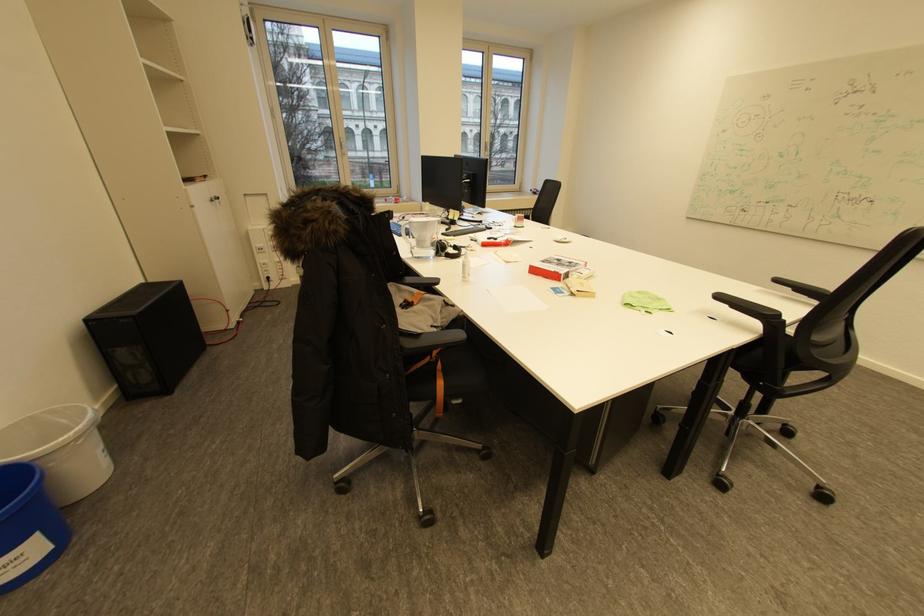
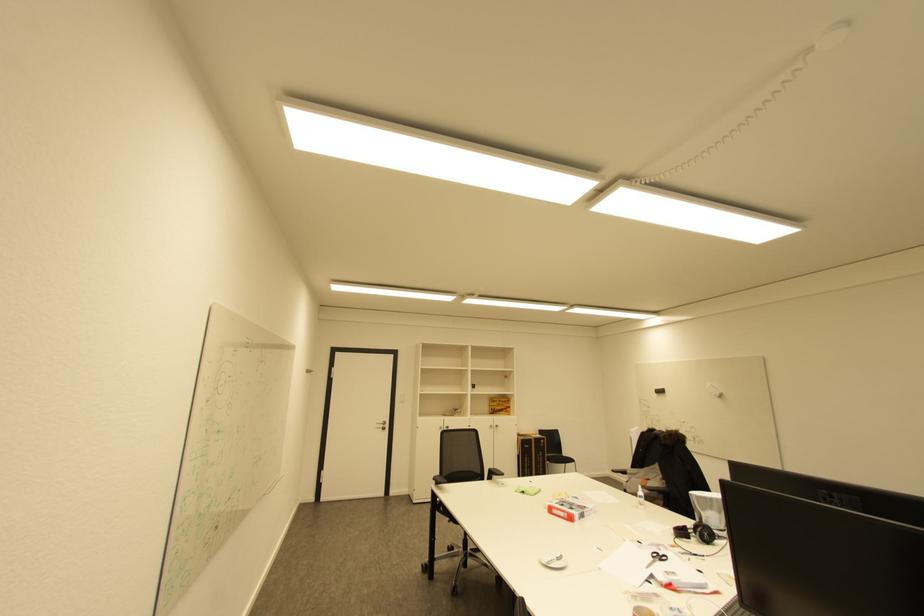
Find the pixel in the second image that matches point 576,262 in the first image.

(568, 506)